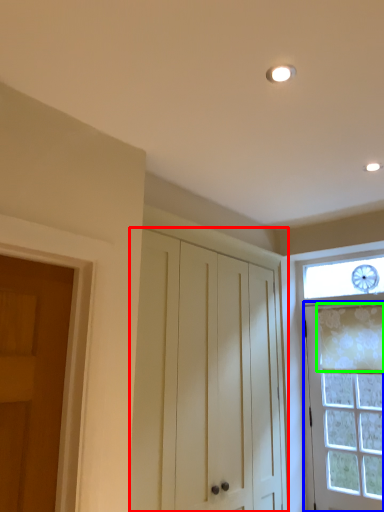
Question: Which object is the closest to the cabinetry (highlighted by a red box)? Choose among these: door (highlighted by a blue box) or curtain (highlighted by a green box).

Choices:
 (A) door
 (B) curtain

Answer: (A)